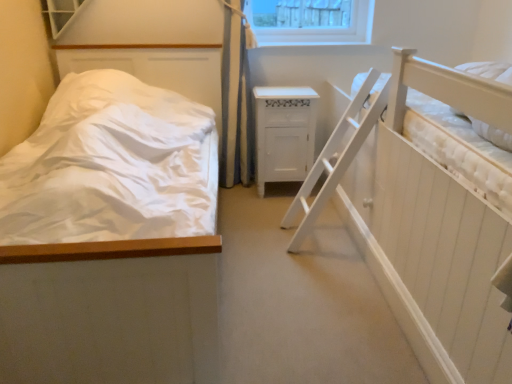
What is the approximate height of white wood cabinet at center?

white wood cabinet at center is 68.47 centimeters in height.

The image size is (512, 384). Describe the element at coordinates (435, 230) in the screenshot. I see `white wooden hospital bed at right` at that location.

This screenshot has height=384, width=512. What are the coordinates of `white wood cabinet at center` in the screenshot? It's located at (284, 133).

Is the depth of white matte bed at left less than that of white textured window at upper left?

Yes, white matte bed at left is closer to the camera.

Find the location of a particular element. bed located in front of the white textured window at upper left is located at coordinates (110, 238).

Would you say white matte bed at left is to the left or to the right of white textured window at upper left in the picture?

Clearly, white matte bed at left is on the right of white textured window at upper left in the image.

From the image's perspective, which one is positioned lower, white matte bed at left or white textured window at upper left?

white matte bed at left, from the image's perspective.

Who is shorter, white wooden hospital bed at right or white wood cabinet at center?

Standing shorter between the two is white wood cabinet at center.

Measure the distance between white wooden hospital bed at right and white wood cabinet at center.

white wooden hospital bed at right and white wood cabinet at center are 30.99 inches apart.

At what (x,y) coordinates should I click in order to perform the action: click on hospital bed positioned vertically above the white wood cabinet at center (from a real-world perspective). Please return your answer as a coordinate pair (x, y). Image resolution: width=512 pixels, height=384 pixels. Looking at the image, I should click on (435, 230).

Is white wooden hospital bed at right facing towards white wood cabinet at center?

No.

Would you say white textured window at upper left contains white wood cabinet at center?

Definitely not — white wood cabinet at center is not inside white textured window at upper left.

Which of these two, white textured window at upper left or white wood cabinet at center, is bigger?

With larger size is white wood cabinet at center.

Considering the relative sizes of white textured window at upper left and white wood cabinet at center in the image provided, is white textured window at upper left taller than white wood cabinet at center?

No, white textured window at upper left is not taller than white wood cabinet at center.

Would you consider white textured window at upper left to be distant from white wood cabinet at center?

That's right, there is a large distance between white textured window at upper left and white wood cabinet at center.

From the picture: Does white matte bed at left come behind white wood cabinet at center?

No, it is in front of white wood cabinet at center.

From the image's perspective, between white matte bed at left and white wood cabinet at center, which one is located above?

white wood cabinet at center.

Is white matte bed at left outside of white wood cabinet at center?

Absolutely, white matte bed at left is external to white wood cabinet at center.

Who is bigger, white matte bed at left or white wood cabinet at center?

Bigger between the two is white matte bed at left.

Which object is closer to the camera, white wood cabinet at center or white wooden hospital bed at right?

Positioned in front is white wooden hospital bed at right.

Is white wood cabinet at center to the right of white wooden hospital bed at right from the viewer's perspective?

Incorrect, white wood cabinet at center is not on the right side of white wooden hospital bed at right.

How different are the orientations of white wood cabinet at center and white wooden hospital bed at right in degrees?

They differ by 179 degrees in their facing directions.

You are a GUI agent. You are given a task and a screenshot of the screen. Output one action in this format:
    pyautogui.click(x=<x>, y=<y>)
    Task: Click on the hospital bed that is below the white wood cabinet at center (from the image's perspective)
    This screenshot has width=512, height=384.
    Given the screenshot: What is the action you would take?
    pyautogui.click(x=435, y=230)

Is white wood cabinet at center to the right of white textured window at upper left from the viewer's perspective?

Yes.

Is white wood cabinet at center directly adjacent to white textured window at upper left?

No, white wood cabinet at center is not next to white textured window at upper left.

From the image's perspective, is white wood cabinet at center on top of white textured window at upper left?

Incorrect, from the image's perspective, white wood cabinet at center is lower than white textured window at upper left.

Is white wood cabinet at center completely or partially outside of white textured window at upper left?

Yes, white wood cabinet at center is not within white textured window at upper left.

In the scene shown: Is white wooden hospital bed at right facing away from white textured window at upper left?

No.

Is white wooden hospital bed at right taller than white textured window at upper left?

Yes.

Visually, is white wooden hospital bed at right positioned to the left or to the right of white textured window at upper left?

From the image, it's evident that white wooden hospital bed at right is to the right of white textured window at upper left.

Image resolution: width=512 pixels, height=384 pixels. Find the location of `bed lying in front of the white textured window at upper left`. bed lying in front of the white textured window at upper left is located at coordinates (110, 238).

Image resolution: width=512 pixels, height=384 pixels. What are the coordinates of `nightstand on the left of the white wooden hospital bed at right` in the screenshot? It's located at (284, 133).

Looking at this image, looking at the image, which one is located closer to white textured window at upper left, white matte bed at left or white wood cabinet at center?

white matte bed at left is positioned closer to the anchor white textured window at upper left.

When comparing their distances from white wood cabinet at center, does white textured window at upper left or white wooden hospital bed at right seem further?

The object further to white wood cabinet at center is white textured window at upper left.

Looking at the image, which one is located further to white wood cabinet at center, white matte bed at left or white textured window at upper left?

Among the two, white textured window at upper left is located further to white wood cabinet at center.

Based on their spatial positions, is white matte bed at left or white wooden hospital bed at right further from white wood cabinet at center?

Among the two, white matte bed at left is located further to white wood cabinet at center.

From the image, which object appears to be farther from white matte bed at left, white textured window at upper left or white wooden hospital bed at right?

Among the two, white textured window at upper left is located further to white matte bed at left.

Based on their spatial positions, is white textured window at upper left or white matte bed at left closer to white wooden hospital bed at right?

Among the two, white matte bed at left is located nearer to white wooden hospital bed at right.

Looking at the image, which one is located further to white matte bed at left, white wood cabinet at center or white wooden hospital bed at right?

white wood cabinet at center.

When comparing their distances from white textured window at upper left, does white wooden hospital bed at right or white matte bed at left seem further?

white wooden hospital bed at right lies further to white textured window at upper left than the other object.

The image size is (512, 384). I want to click on nightstand between white textured window at upper left and white wooden hospital bed at right from left to right, so click(x=284, y=133).

Identify the location of window between white matte bed at left and white wood cabinet at center along the z-axis. This screenshot has width=512, height=384. (60, 14).

Find the location of a particular element. bed between white wooden hospital bed at right and white wood cabinet at center along the z-axis is located at coordinates (110, 238).

Identify the location of bed located between white textured window at upper left and white wooden hospital bed at right in the left-right direction. The width and height of the screenshot is (512, 384). (110, 238).